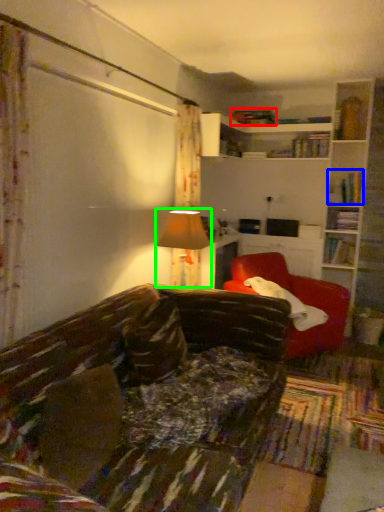
Question: Which object is positioned farthest from book (highlighted by a red box)? Select from book (highlighted by a blue box) and table lamp (highlighted by a green box).

Choices:
 (A) book
 (B) table lamp

Answer: (B)